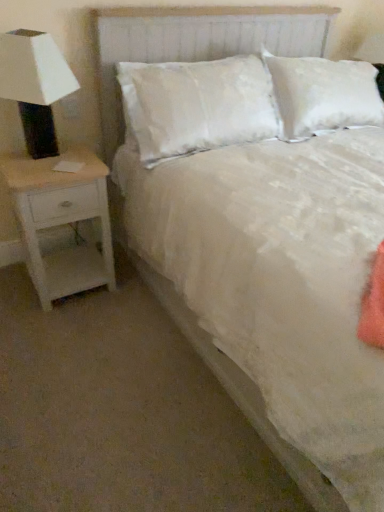
Question: Relative to white matte lamp at left, is white textured headboard at center in front or behind?

Choices:
 (A) behind
 (B) front

Answer: (A)

Question: In terms of size, does white textured headboard at center appear bigger or smaller than white matte lamp at left?

Choices:
 (A) small
 (B) big

Answer: (B)

Question: Which is nearer to the white matte lamp at left?

Choices:
 (A) white textured headboard at center
 (B) white wood nightstand at left

Answer: (B)

Question: Based on their relative distances, which object is farther from the white matte lamp at left?

Choices:
 (A) white wood nightstand at left
 (B) white textured headboard at center

Answer: (B)